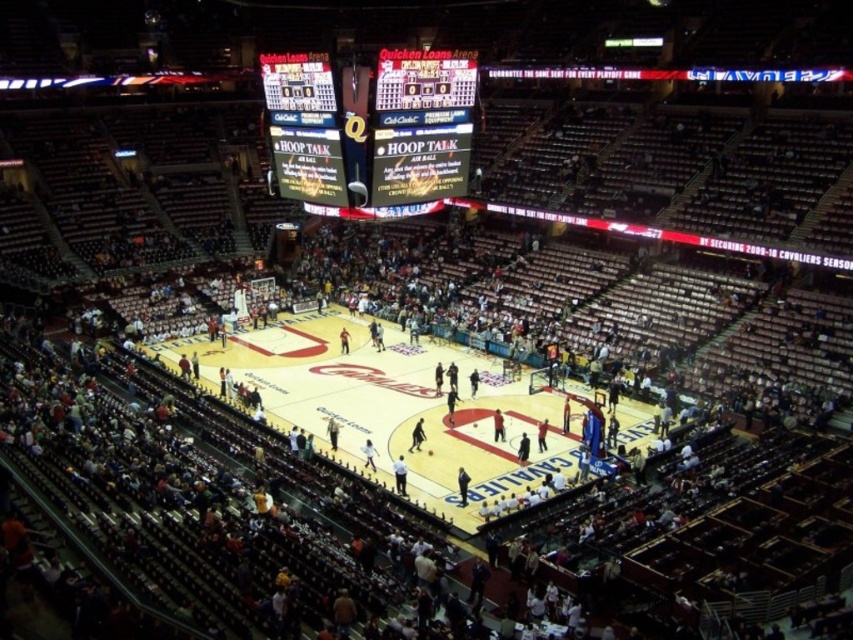
Is black glossy scoreboard at upper center to the left of matte black scoreboard at upper center from the viewer's perspective?

Indeed, black glossy scoreboard at upper center is positioned on the left side of matte black scoreboard at upper center.

The width and height of the screenshot is (853, 640). Find the location of `black glossy scoreboard at upper center`. black glossy scoreboard at upper center is located at coordinates (372, 129).

The width and height of the screenshot is (853, 640). Identify the location of black glossy scoreboard at upper center. (372, 129).